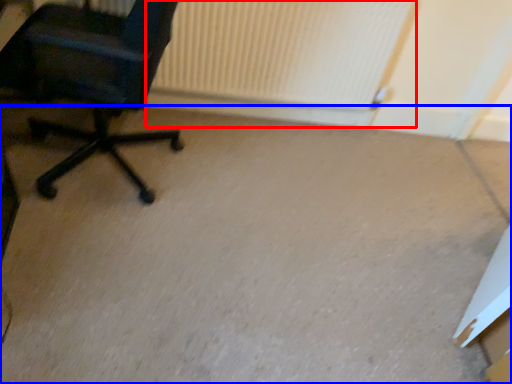
Question: Which of the following is the farthest to the observer, radiator (highlighted by a red box) or concrete (highlighted by a blue box)?

Choices:
 (A) radiator
 (B) concrete

Answer: (A)